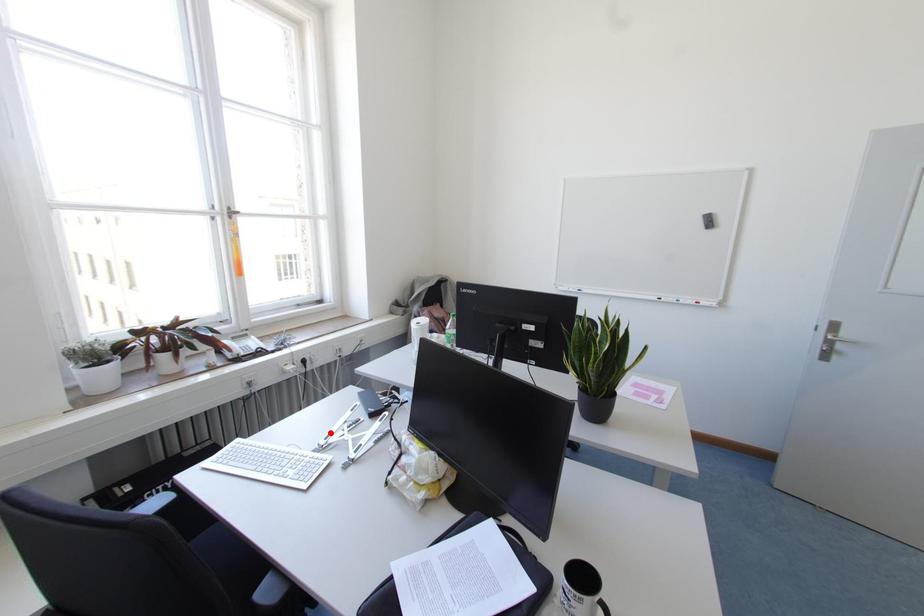
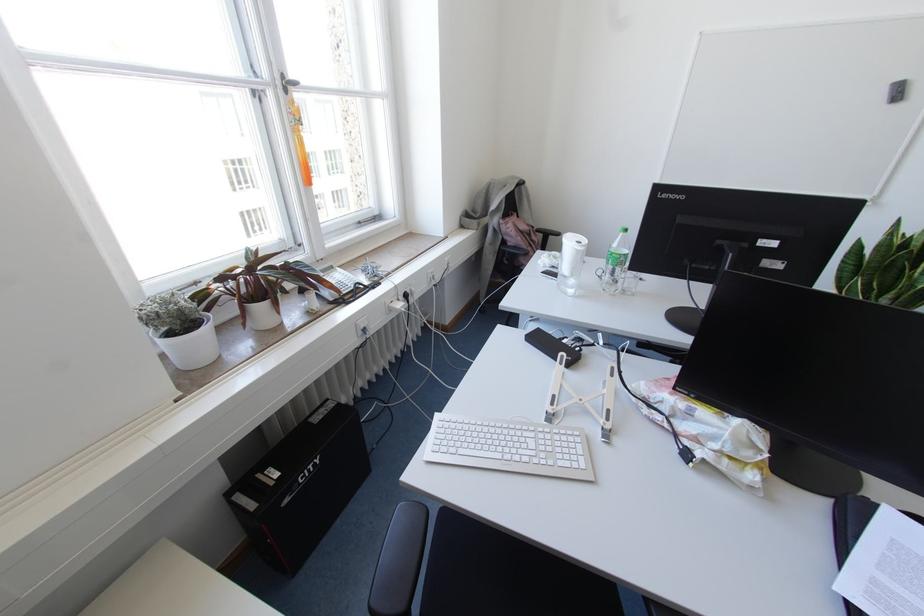
Where in the second image is the point corresponding to the highlighted location from the first image?

(553, 395)